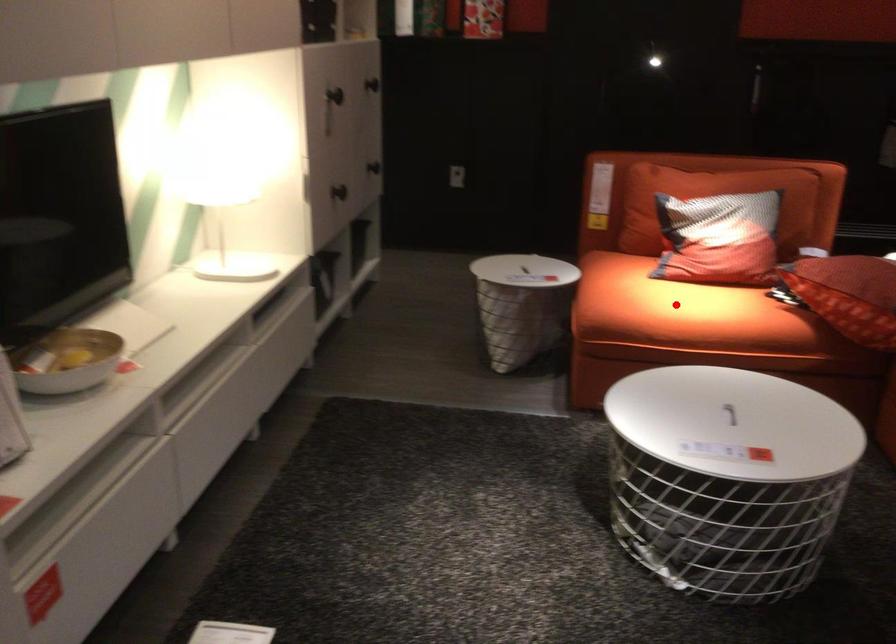
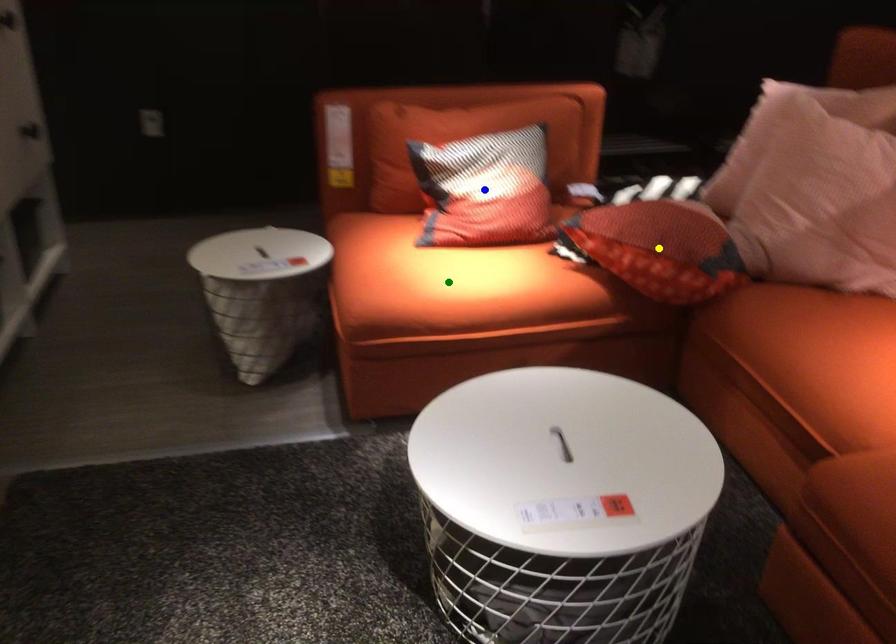
Question: I am providing you with two images of the same scene from different viewpoints. A red point is marked on the first image. You are given multiple points on the second image. Which mark in image 2 goes with the point in image 1?

Choices:
 (A) blue point
 (B) yellow point
 (C) green point

Answer: (C)